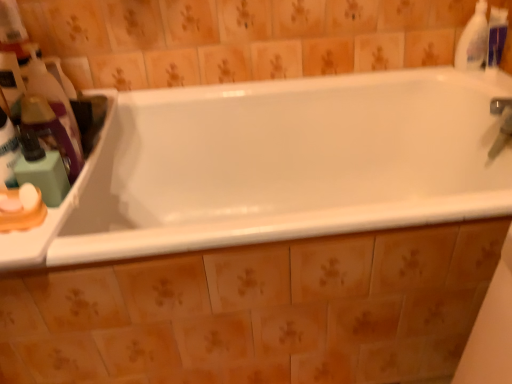
Question: Is white plastic bottle at upper right, which is the 1th cleaning product from right to left, in front of or behind white glossy bathtub at center in the image?

Choices:
 (A) behind
 (B) front

Answer: (A)

Question: In terms of height, does white plastic bottle at upper right, the third cleaning product in the left-to-right sequence, look taller or shorter compared to white glossy bathtub at center?

Choices:
 (A) tall
 (B) short

Answer: (B)

Question: Considering the real-world distances, which object is farthest from the white plastic counter at left?

Choices:
 (A) white plastic bottle at upper right, the first cleaning product when ordered from back to front
 (B) translucent plastic bottle at left, which is the third cleaning product in back-to-front order
 (C) translucent plastic bottle at left, the 1th cleaning product when ordered from left to right
 (D) matte green soap at left
 (E) white glossy bathtub at center

Answer: (A)

Question: Which is farther from the white glossy bathtub at center?

Choices:
 (A) white plastic counter at left
 (B) white plastic bottle at upper right, which is the 1th cleaning product from right to left
 (C) translucent plastic bottle at left, acting as the 2th cleaning product starting from the left
 (D) matte green soap at left
 (E) translucent plastic bottle at left, acting as the third cleaning product starting from the right

Answer: (D)